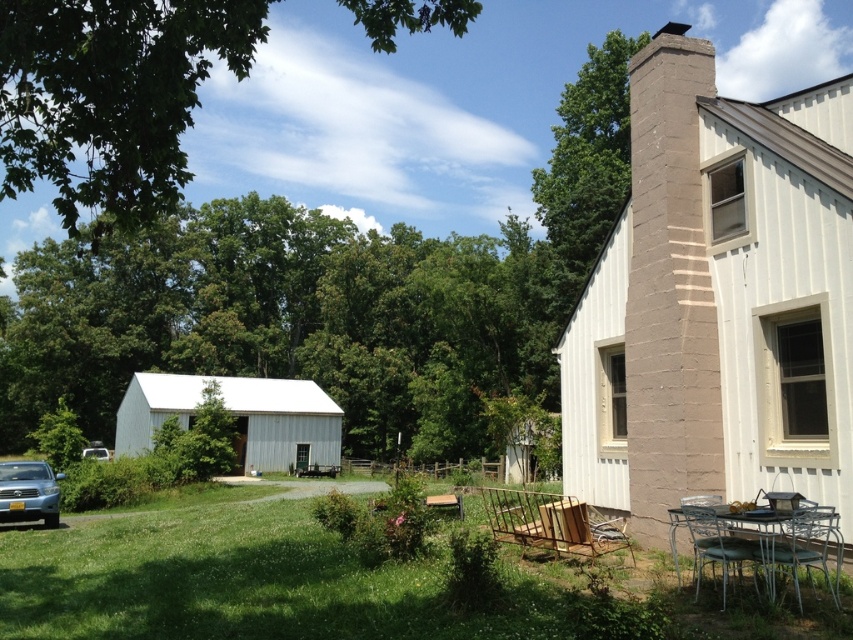
Question: Does green leafy tree at upper left appear on the left side of green leafy tree at upper center?

Choices:
 (A) yes
 (B) no

Answer: (A)

Question: Which point appears closest to the camera in this image?

Choices:
 (A) (9, 520)
 (B) (584, 76)

Answer: (A)

Question: Which point is closer to the camera?

Choices:
 (A) (676, 476)
 (B) (54, 474)
 (C) (164, 531)

Answer: (A)

Question: Can you confirm if metallic silver chair at lower right is bigger than wooden swing at lower center?

Choices:
 (A) yes
 (B) no

Answer: (B)

Question: Which point appears farthest from the camera in this image?

Choices:
 (A) (88, 451)
 (B) (15, 516)
 (C) (722, 477)

Answer: (A)

Question: Is metallic green swing set at lower center to the left of metallic silver chair at lower right from the viewer's perspective?

Choices:
 (A) no
 (B) yes

Answer: (B)